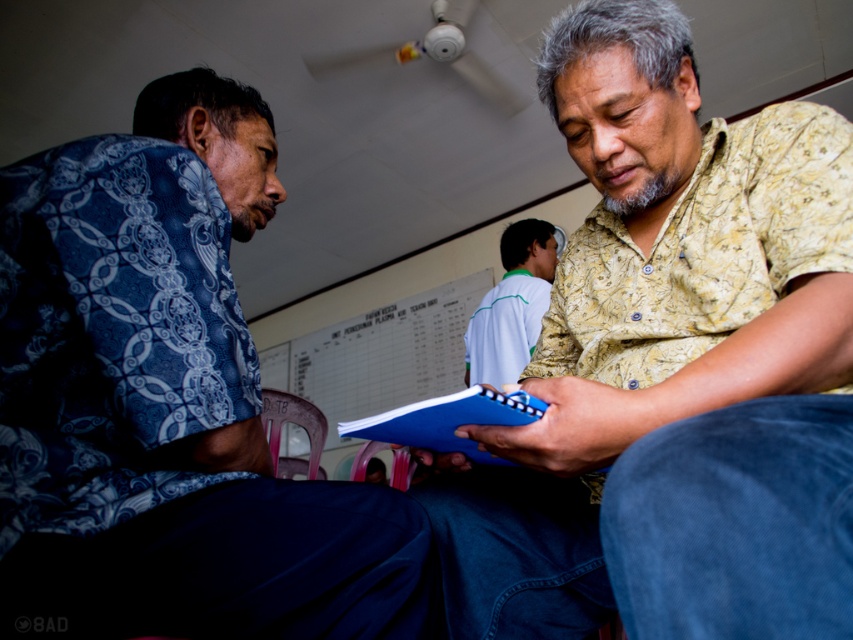
Is the position of plastic chair at lower center more distant than that of pink plastic chair at lower center?

Yes, it is behind pink plastic chair at lower center.

Which is behind, point (281, 396) or point (361, 474)?

The point (361, 474) is more distant.

Between point (326, 426) and point (381, 449), which one is positioned behind?

Point (381, 449)

You are a GUI agent. You are given a task and a screenshot of the screen. Output one action in this format:
    pyautogui.click(x=<x>, y=<y>)
    Task: Click on the plastic chair at lower center
    
    Given the screenshot: What is the action you would take?
    pyautogui.click(x=296, y=424)

Does blue printed shirt at left have a greater width compared to light blue fabric shirt at center?

Indeed, blue printed shirt at left has a greater width compared to light blue fabric shirt at center.

Can you confirm if blue printed shirt at left is positioned above light blue fabric shirt at center?

No.

At what (x,y) coordinates should I click in order to perform the action: click on blue printed shirt at left. Please return your answer as a coordinate pair (x, y). This screenshot has height=640, width=853. Looking at the image, I should click on click(x=169, y=403).

Which is behind, point (660, 333) or point (550, 266)?

The point (550, 266) is more distant.

Between yellow floral shirt at center and light blue fabric shirt at center, which one is positioned lower?

yellow floral shirt at center is lower down.

Which is behind, point (621, 448) or point (468, 326)?

The point (468, 326) is more distant.

This screenshot has width=853, height=640. What are the coordinates of `yellow floral shirt at center` in the screenshot? It's located at (672, 369).